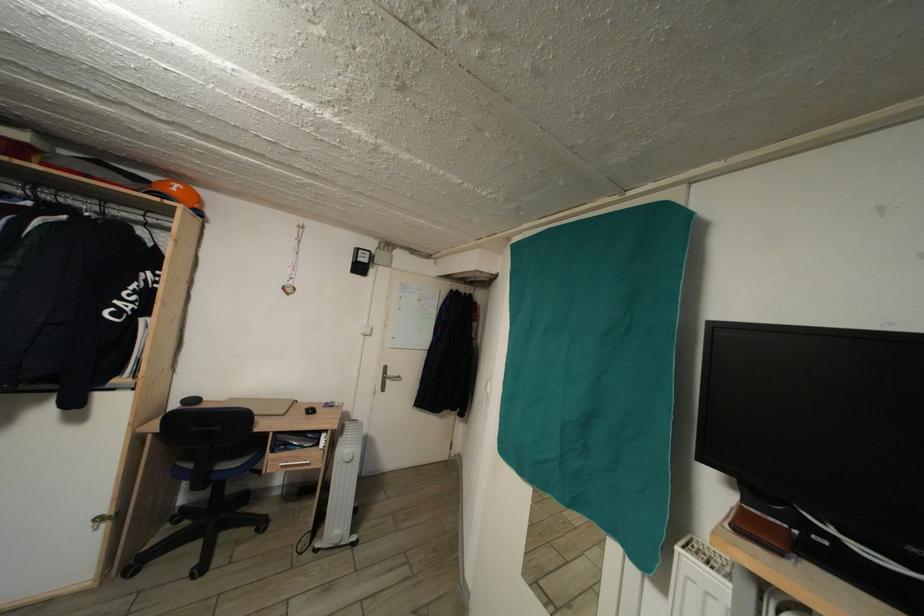
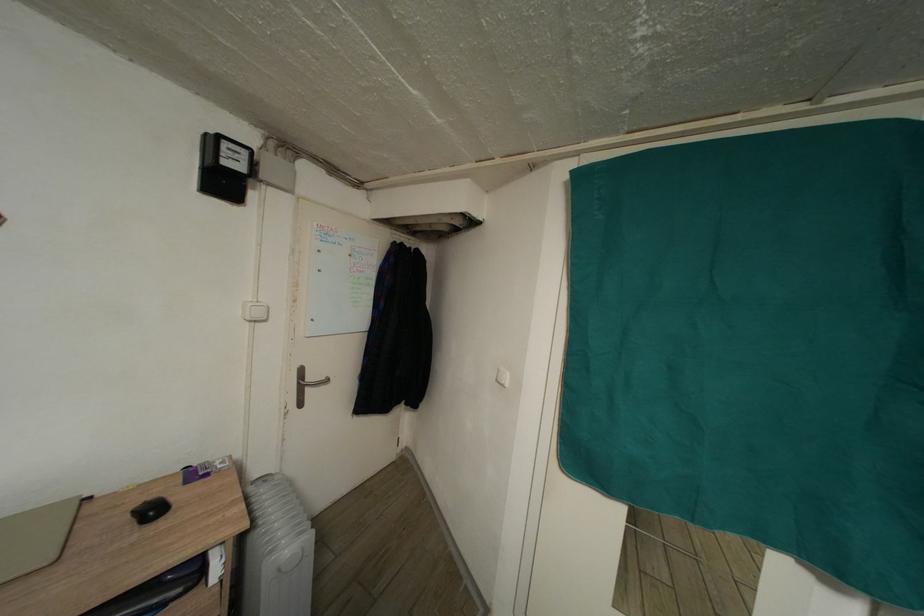
Which direction would the cameraman need to move to produce the second image?

The cameraman moved toward left, forward.